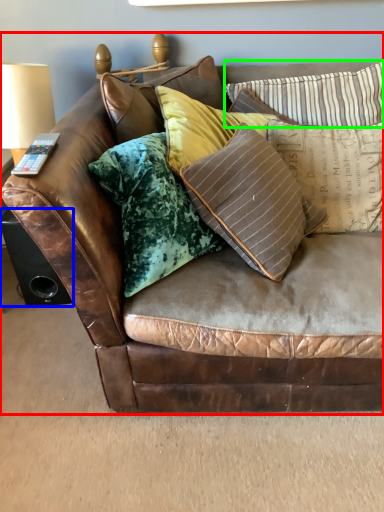
Question: Which object is the closest to the studio couch (highlighted by a red box)? Choose among these: speaker (highlighted by a blue box) or pillow (highlighted by a green box).

Choices:
 (A) speaker
 (B) pillow

Answer: (B)